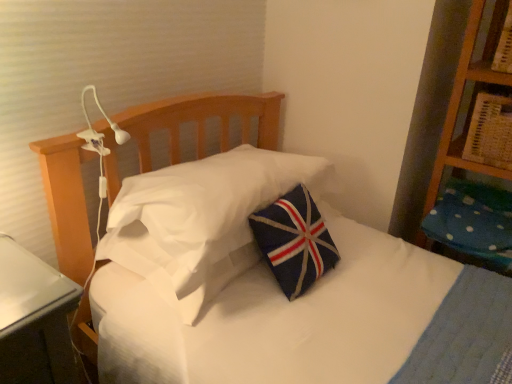
Locate an element on the screen. This screenshot has width=512, height=384. wooden bookshelf at upper right is located at coordinates (464, 136).

I want to click on navy felt pillow at center, placed as the 1th pillow when sorted from left to right, so click(202, 220).

In order to face navy felt pillow at center, the 2th pillow in the right-to-left sequence, should I rotate leftwards or rightwards?

Turn left approximately 2.801 degrees to face it.

This screenshot has width=512, height=384. I want to click on wooden bookshelf at upper right, so click(x=464, y=136).

Is navy felt pillow at center, placed as the 1th pillow when sorted from left to right, positioned in front of wooden bookshelf at upper right?

Yes, navy felt pillow at center, placed as the 1th pillow when sorted from left to right, is closer to the camera.

Is there a large distance between navy felt pillow at center, the 2th pillow in the right-to-left sequence, and wooden bookshelf at upper right?

No, navy felt pillow at center, the 2th pillow in the right-to-left sequence, is not far away from wooden bookshelf at upper right.

Considering the points (274, 151) and (453, 172), which point is behind, point (274, 151) or point (453, 172)?

Positioned behind is point (453, 172).

Can you confirm if blue dotted fabric pillow at right, acting as the 2th pillow starting from the left, is taller than wooden bookshelf at upper right?

In fact, blue dotted fabric pillow at right, acting as the 2th pillow starting from the left, may be shorter than wooden bookshelf at upper right.

Considering their positions, is blue dotted fabric pillow at right, acting as the first pillow starting from the right, located in front of or behind wooden bookshelf at upper right?

blue dotted fabric pillow at right, acting as the first pillow starting from the right, is behind wooden bookshelf at upper right.

Based on the photo, between blue dotted fabric pillow at right, acting as the 2th pillow starting from the left, and wooden bookshelf at upper right, which one appears on the left side from the viewer's perspective?

Positioned to the left is wooden bookshelf at upper right.

Which is behind, point (501, 228) or point (458, 102)?

Point (501, 228)

Is point (154, 270) positioned before point (452, 217)?

Yes, point (154, 270) is closer to viewer.

Looking at the image, does navy felt pillow at center, placed as the 1th pillow when sorted from left to right, seem bigger or smaller compared to blue dotted fabric pillow at right, acting as the first pillow starting from the right?

Clearly, navy felt pillow at center, placed as the 1th pillow when sorted from left to right, is larger in size than blue dotted fabric pillow at right, acting as the first pillow starting from the right.

Is navy felt pillow at center, the 2th pillow in the right-to-left sequence, directly adjacent to blue dotted fabric pillow at right, acting as the first pillow starting from the right?

There is a gap between navy felt pillow at center, the 2th pillow in the right-to-left sequence, and blue dotted fabric pillow at right, acting as the first pillow starting from the right.

Where is `shelf located above the navy felt pillow at center, the 2th pillow in the right-to-left sequence (from a real-world perspective)`? The image size is (512, 384). shelf located above the navy felt pillow at center, the 2th pillow in the right-to-left sequence (from a real-world perspective) is located at coordinates (464, 136).

Can we say wooden bookshelf at upper right lies outside navy felt pillow at center, placed as the 1th pillow when sorted from left to right?

That's correct, wooden bookshelf at upper right is outside of navy felt pillow at center, placed as the 1th pillow when sorted from left to right.

Considering the positions of points (472, 165) and (248, 214), is point (472, 165) closer to camera compared to point (248, 214)?

That is False.

Between blue dotted fabric pillow at right, acting as the 2th pillow starting from the left, and navy felt pillow at center, the 2th pillow in the right-to-left sequence, which one is positioned in front?

navy felt pillow at center, the 2th pillow in the right-to-left sequence, is in front.

From the picture: From the image's perspective, relative to navy felt pillow at center, the 2th pillow in the right-to-left sequence, is blue dotted fabric pillow at right, acting as the first pillow starting from the right, above or below?

blue dotted fabric pillow at right, acting as the first pillow starting from the right, is situated lower than navy felt pillow at center, the 2th pillow in the right-to-left sequence, in the image.

Between blue dotted fabric pillow at right, acting as the 2th pillow starting from the left, and navy felt pillow at center, the 2th pillow in the right-to-left sequence, which one has smaller size?

Smaller between the two is blue dotted fabric pillow at right, acting as the 2th pillow starting from the left.

At what (x,y) coordinates should I click in order to perform the action: click on pillow below the navy felt pillow at center, placed as the 1th pillow when sorted from left to right (from the image's perspective). Please return your answer as a coordinate pair (x, y). Looking at the image, I should click on [x=472, y=218].

From the image's perspective, is wooden bookshelf at upper right beneath blue dotted fabric pillow at right, acting as the first pillow starting from the right?

Actually, wooden bookshelf at upper right appears above blue dotted fabric pillow at right, acting as the first pillow starting from the right, in the image.

Is wooden bookshelf at upper right behind blue dotted fabric pillow at right, acting as the first pillow starting from the right?

No, wooden bookshelf at upper right is closer to the camera.

Would you say wooden bookshelf at upper right is outside blue dotted fabric pillow at right, acting as the first pillow starting from the right?

Yes, wooden bookshelf at upper right is not within blue dotted fabric pillow at right, acting as the first pillow starting from the right.

Locate an element on the screen. The image size is (512, 384). shelf positioned vertically above the navy felt pillow at center, placed as the 1th pillow when sorted from left to right (from a real-world perspective) is located at coordinates (464, 136).

Locate an element on the screen. The height and width of the screenshot is (384, 512). shelf that appears on the left of blue dotted fabric pillow at right, acting as the 2th pillow starting from the left is located at coordinates (464, 136).

Considering their positions, is blue dotted fabric pillow at right, acting as the 2th pillow starting from the left, positioned further to navy felt pillow at center, the 2th pillow in the right-to-left sequence, than wooden bookshelf at upper right?

Among the two, wooden bookshelf at upper right is located further to navy felt pillow at center, the 2th pillow in the right-to-left sequence.

Based on the photo, which object lies further to the anchor point blue dotted fabric pillow at right, acting as the first pillow starting from the right, wooden bookshelf at upper right or navy felt pillow at center, placed as the 1th pillow when sorted from left to right?

navy felt pillow at center, placed as the 1th pillow when sorted from left to right, lies further to blue dotted fabric pillow at right, acting as the first pillow starting from the right, than the other object.

When comparing their distances from navy felt pillow at center, placed as the 1th pillow when sorted from left to right, does wooden bookshelf at upper right or blue dotted fabric pillow at right, acting as the 2th pillow starting from the left, seem further?

Based on the image, wooden bookshelf at upper right appears to be further to navy felt pillow at center, placed as the 1th pillow when sorted from left to right.

Considering their positions, is navy felt pillow at center, the 2th pillow in the right-to-left sequence, positioned further to blue dotted fabric pillow at right, acting as the 2th pillow starting from the left, than wooden bookshelf at upper right?

navy felt pillow at center, the 2th pillow in the right-to-left sequence, lies further to blue dotted fabric pillow at right, acting as the 2th pillow starting from the left, than the other object.

Looking at the image, which one is located closer to wooden bookshelf at upper right, blue dotted fabric pillow at right, acting as the first pillow starting from the right, or navy felt pillow at center, the 2th pillow in the right-to-left sequence?

blue dotted fabric pillow at right, acting as the first pillow starting from the right, is closer to wooden bookshelf at upper right.

Based on their spatial positions, is navy felt pillow at center, placed as the 1th pillow when sorted from left to right, or blue dotted fabric pillow at right, acting as the 2th pillow starting from the left, closer to wooden bookshelf at upper right?

blue dotted fabric pillow at right, acting as the 2th pillow starting from the left.

The image size is (512, 384). I want to click on shelf located between navy felt pillow at center, the 2th pillow in the right-to-left sequence, and blue dotted fabric pillow at right, acting as the 2th pillow starting from the left, in the left-right direction, so click(x=464, y=136).